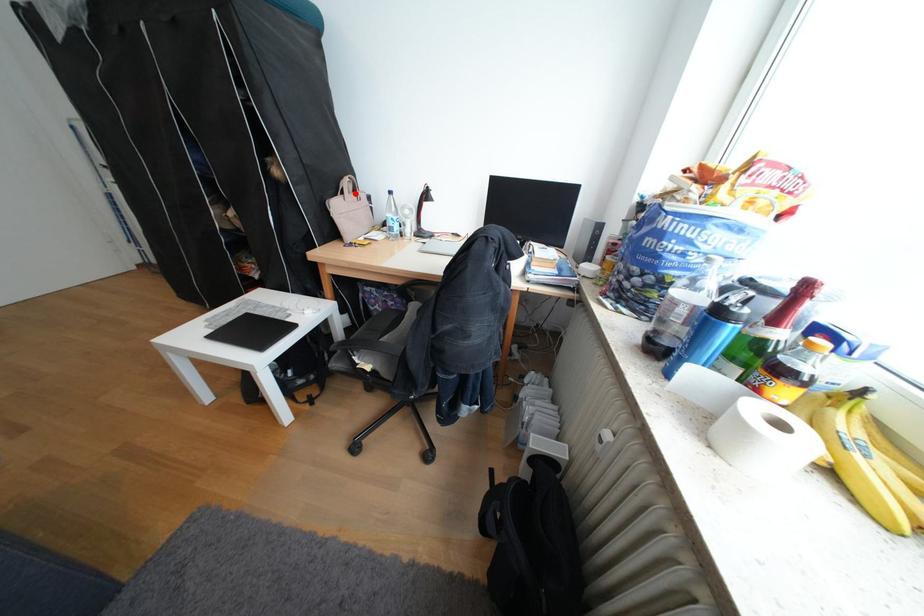
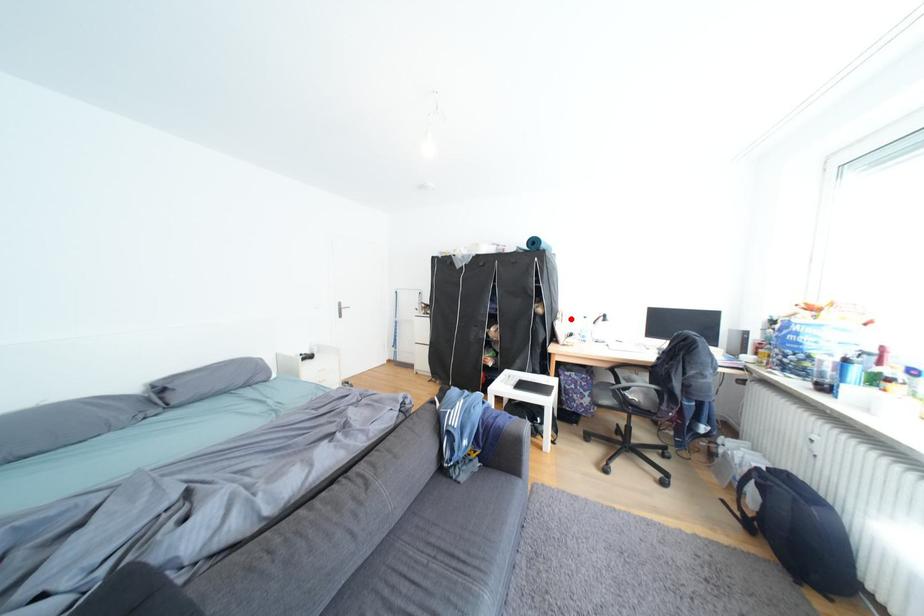
I am providing you with two images of the same scene from different viewpoints. A red point is marked on the first image and another point is marked on the second image. Are the points marked in image1 and image2 representing the same 3D position?

Yes